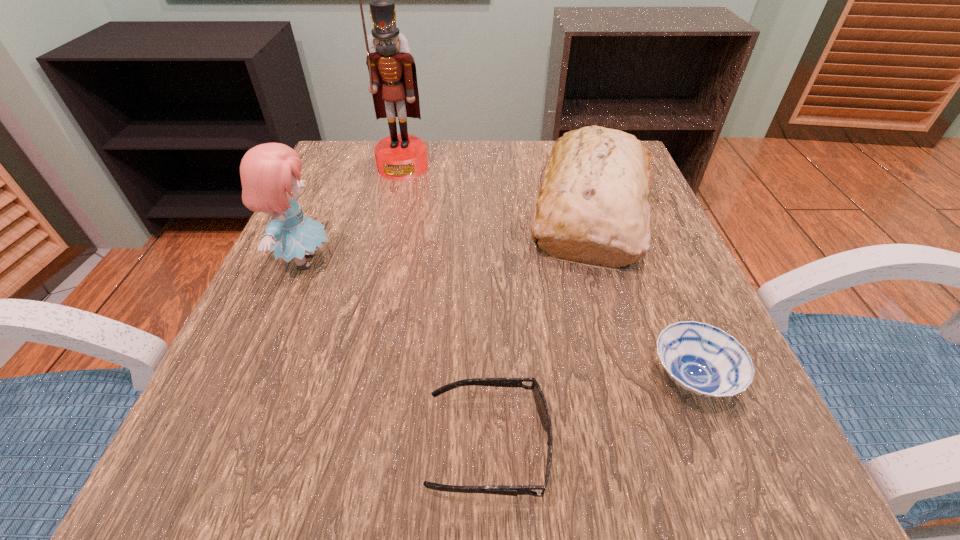
I want to click on the tallest object, so click(x=393, y=79).

The image size is (960, 540). I want to click on the fourth object from right to left, so click(393, 79).

This screenshot has width=960, height=540. What are the coordinates of `the fourth shortest object` in the screenshot? It's located at (270, 173).

Identify the location of doll. Image resolution: width=960 pixels, height=540 pixels. (270, 173).

Locate an element on the screen. The height and width of the screenshot is (540, 960). the third tallest object is located at coordinates (593, 206).

The height and width of the screenshot is (540, 960). Find the location of `soup bowl`. soup bowl is located at coordinates (704, 360).

The image size is (960, 540). I want to click on sunglasses, so click(x=541, y=405).

Identify the location of vacant space located on the front-facing side of the fourth object from right to left. This screenshot has height=540, width=960. (371, 299).

I want to click on free space located 0.130m on the front-facing side of the fourth shortest object, so click(x=406, y=261).

In order to click on vacant space situated 0.350m on the left of the third shortest object in this screenshot , I will do `click(356, 210)`.